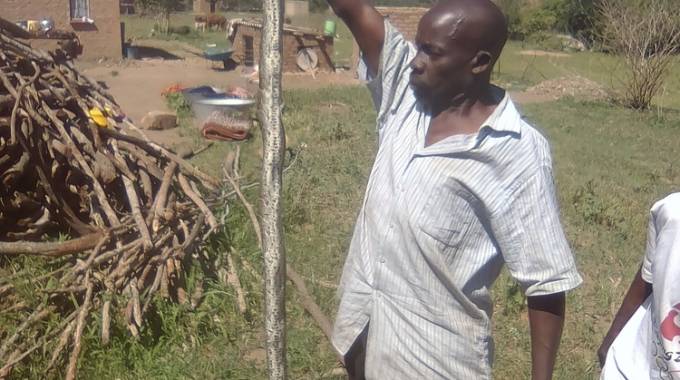
Identify the location of wall. The width and height of the screenshot is (680, 380). (103, 43).